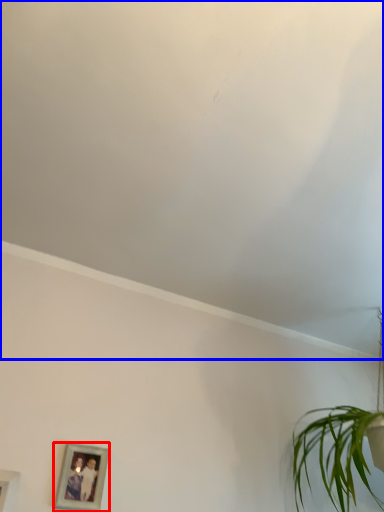
Question: Which point is closer to the camera, picture frame (highlighted by a red box) or cloud (highlighted by a blue box)?

Choices:
 (A) picture frame
 (B) cloud

Answer: (B)